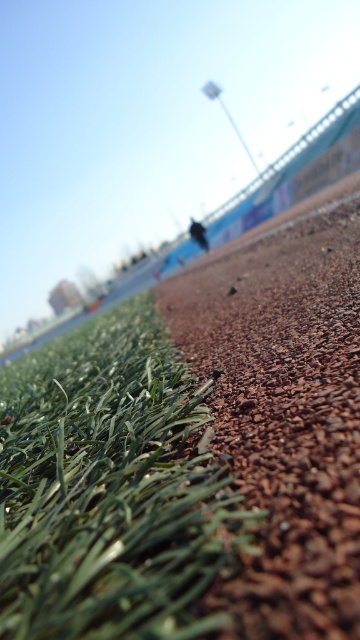
Does green artificial turf at lower left come behind brown gravel at center?

Yes, it is behind brown gravel at center.

Which is behind, point (70, 426) or point (299, 280)?

The point (299, 280) is behind.

Find the location of a particular element. green artificial turf at lower left is located at coordinates (110, 486).